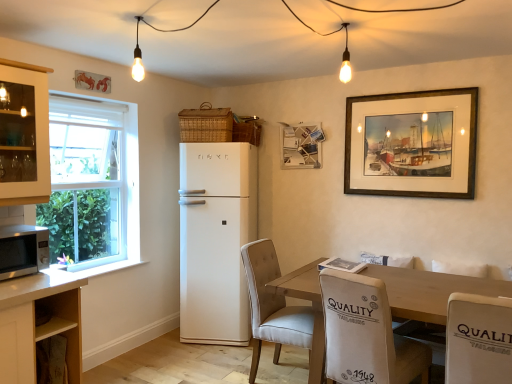
Question: Based on their positions, is beige fabric chair at center, marked as the third chair in a right-to-left arrangement, located to the left or right of wooden table at center?

Choices:
 (A) right
 (B) left

Answer: (B)

Question: Considering the positions of beige fabric chair at center, marked as the third chair in a right-to-left arrangement, and wooden table at center in the image, is beige fabric chair at center, marked as the third chair in a right-to-left arrangement, bigger or smaller than wooden table at center?

Choices:
 (A) big
 (B) small

Answer: (B)

Question: Which object is the closest to the white glass cabinet at left, arranged as the second cabinetry when ordered from the bottom?

Choices:
 (A) beige fabric chair at center, which is the first chair in left-to-right order
 (B) woven brown basket at upper center, placed as the 1th basket when sorted from right to left
 (C) white matte refrigerator at center
 (D) satin silver microwave at lower left
 (E) wooden framed painting at upper right, which appears as the first picture frame when viewed from the right

Answer: (D)

Question: Which object is the closest to the woven brown basket at upper center, which is counted as the second basket, starting from the left?

Choices:
 (A) satin silver microwave at lower left
 (B) white matte refrigerator at center
 (C) woven brown basket at upper center, placed as the 1th basket when sorted from left to right
 (D) white glass cabinet at left, the first cabinetry from the top
 (E) wooden cabinet at lower left, which appears as the second cabinetry when viewed from the top

Answer: (C)